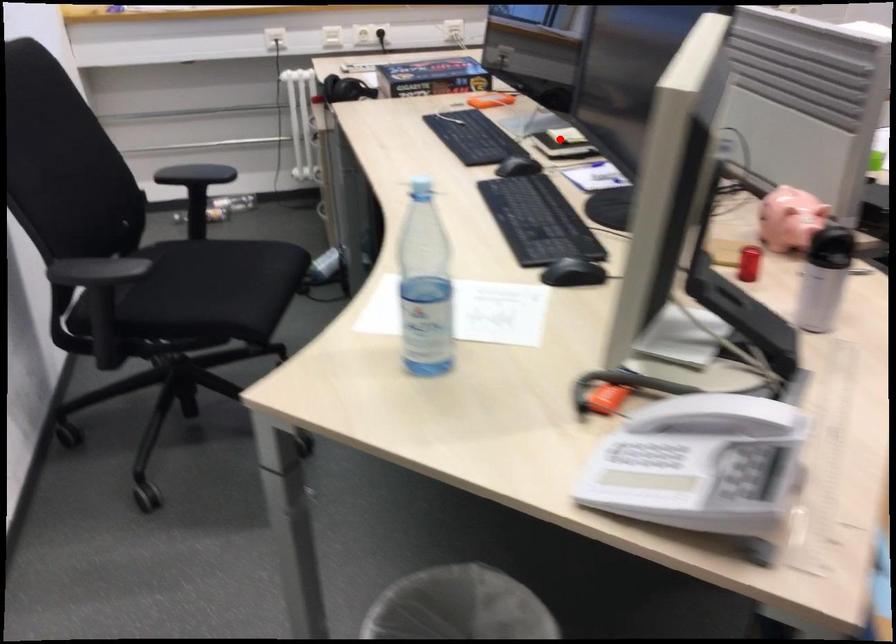
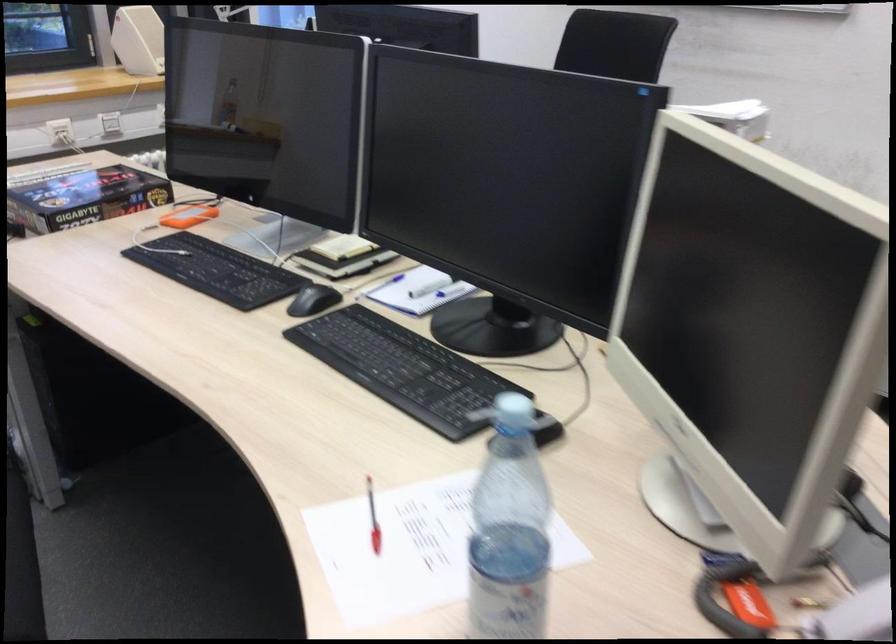
In the second image, find the point that corresponds to the highlighted location in the first image.

(341, 256)